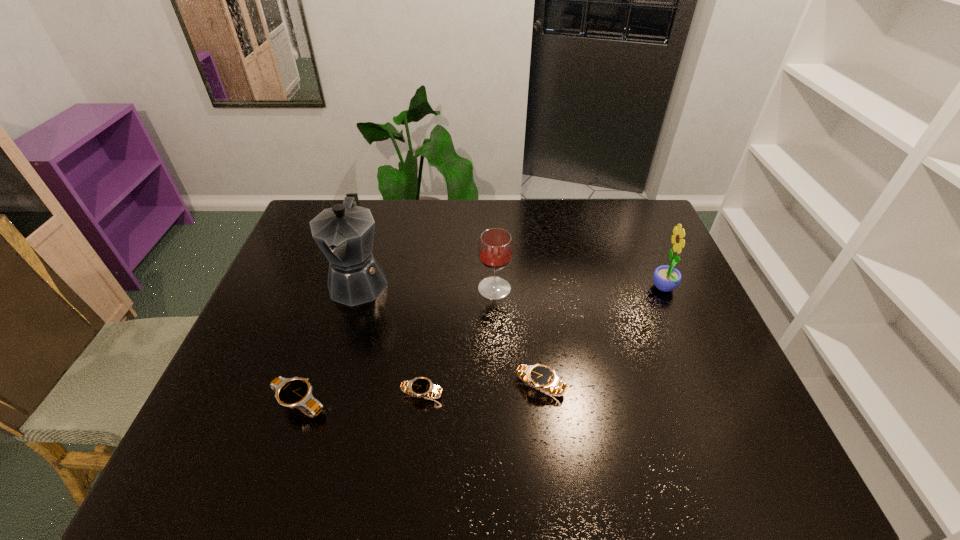
You are a GUI agent. You are given a task and a screenshot of the screen. Output one action in this format:
    pyautogui.click(x=<x>, y=<y>)
    Task: Click on the vacant spot to place a watch on the right
    The width and height of the screenshot is (960, 540).
    Given the screenshot: What is the action you would take?
    pyautogui.click(x=655, y=377)